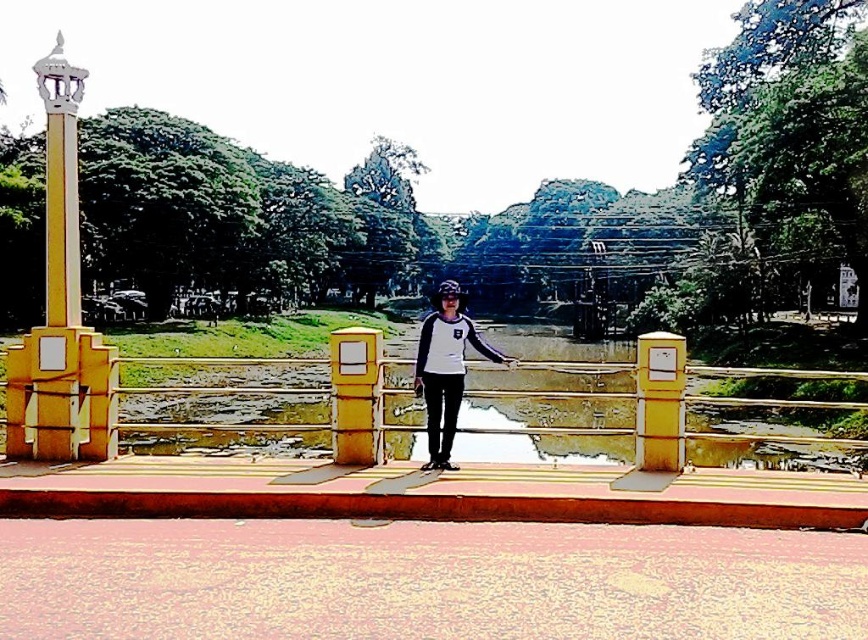
Is yellow matte/light wood lamp post at left below yellow polished stone column at left?

Correct, yellow matte/light wood lamp post at left is located below yellow polished stone column at left.

Describe the element at coordinates (61, 308) in the screenshot. I see `yellow matte/light wood lamp post at left` at that location.

You are a GUI agent. You are given a task and a screenshot of the screen. Output one action in this format:
    pyautogui.click(x=<x>, y=<y>)
    Task: Click on the yellow matte/light wood lamp post at left
    The width and height of the screenshot is (868, 640).
    Given the screenshot: What is the action you would take?
    pyautogui.click(x=61, y=308)

Which is more to the left, white matte shirt at center or yellow matte pillar at center?

yellow matte pillar at center is more to the left.

Can you confirm if white matte shirt at center is positioned to the right of yellow matte pillar at center?

Correct, you'll find white matte shirt at center to the right of yellow matte pillar at center.

Is point (508, 358) closer to camera compared to point (354, 346)?

No.

The image size is (868, 640). Find the location of `white matte shirt at center`. white matte shirt at center is located at coordinates (445, 369).

Is point (58, 145) more distant than point (437, 353)?

Yes, it is.

Who is positioned more to the left, yellow matte/light wood lamp post at left or white matte shirt at center?

yellow matte/light wood lamp post at left

The image size is (868, 640). Describe the element at coordinates (61, 308) in the screenshot. I see `yellow matte/light wood lamp post at left` at that location.

The image size is (868, 640). In order to click on yellow matte/light wood lamp post at left in this screenshot , I will do `click(61, 308)`.